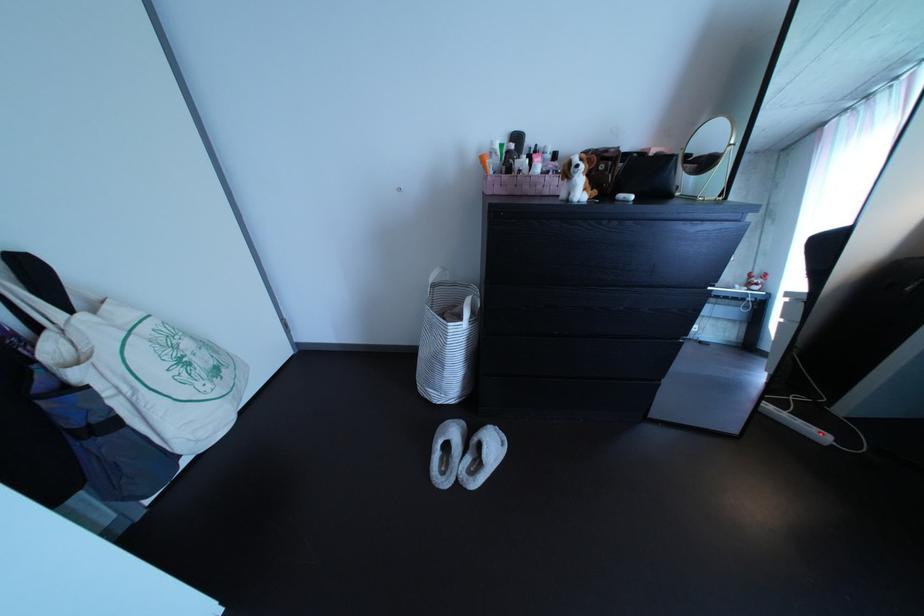
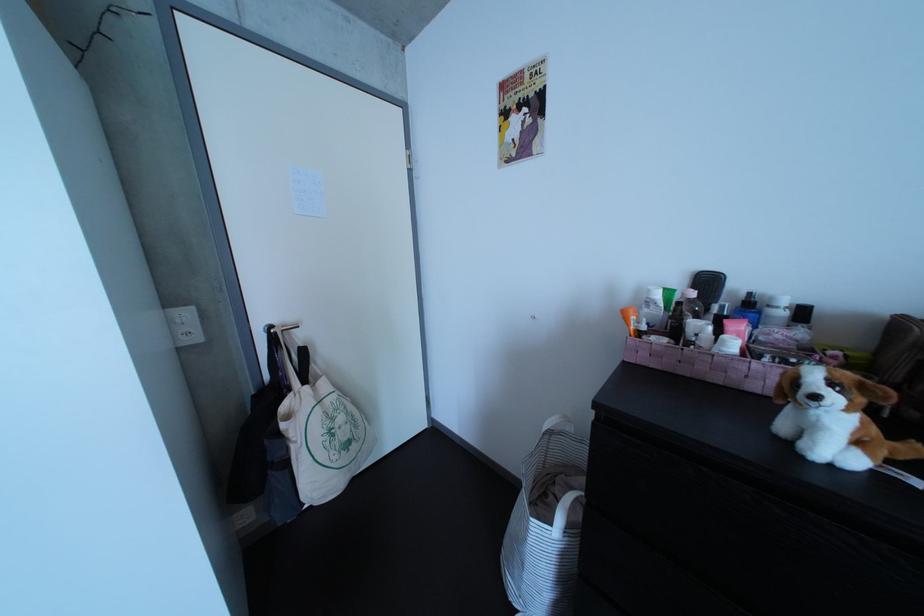
Find the pixel in the second image that matches (201,352) in the first image.

(355, 426)